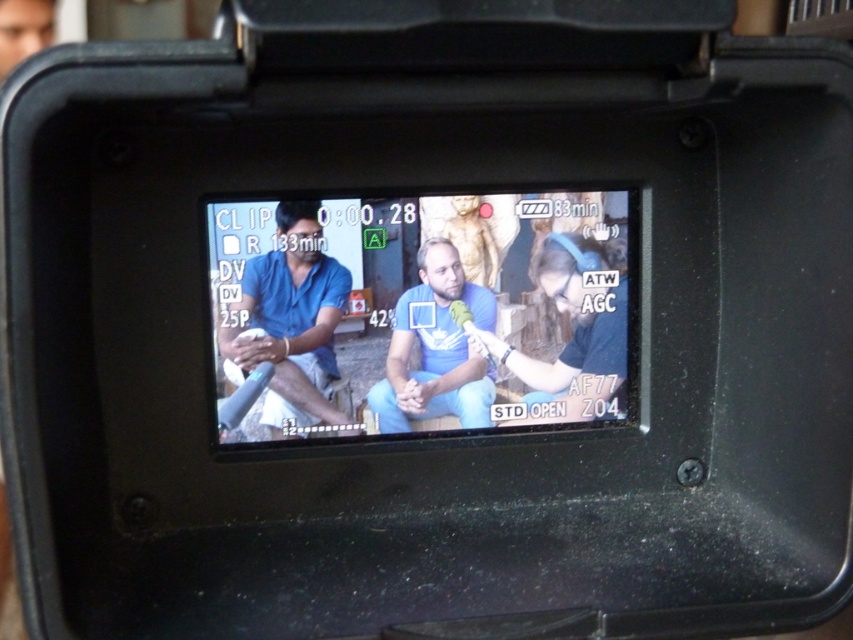
Question: Is blue fabric shirt at center above blue denim jeans at center?

Choices:
 (A) no
 (B) yes

Answer: (B)

Question: Which of the following is the farthest from the observer?

Choices:
 (A) blue matte shirt at center
 (B) matte blue shirt at center

Answer: (A)

Question: Which object is closer to the camera taking this photo?

Choices:
 (A) blue matte shirt at center
 (B) matte blue shirt at center
 (C) blue denim jeans at center
 (D) blue fabric shirt at center

Answer: (B)

Question: Which of the following is the closest to the observer?

Choices:
 (A) blue denim jeans at center
 (B) matte blue shirt at center
 (C) blue fabric shirt at center

Answer: (B)

Question: Is the position of blue denim jeans at center less distant than that of blue matte shirt at center?

Choices:
 (A) yes
 (B) no

Answer: (B)

Question: Is matte blue shirt at center positioned at the back of blue matte shirt at center?

Choices:
 (A) yes
 (B) no

Answer: (B)